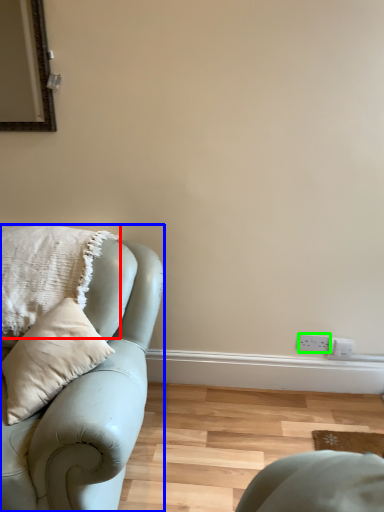
Question: Based on their relative distances, which object is farther from pillow (highlighted by a red box)? Choose from studio couch (highlighted by a blue box) and electric outlet (highlighted by a green box).

Choices:
 (A) studio couch
 (B) electric outlet

Answer: (B)